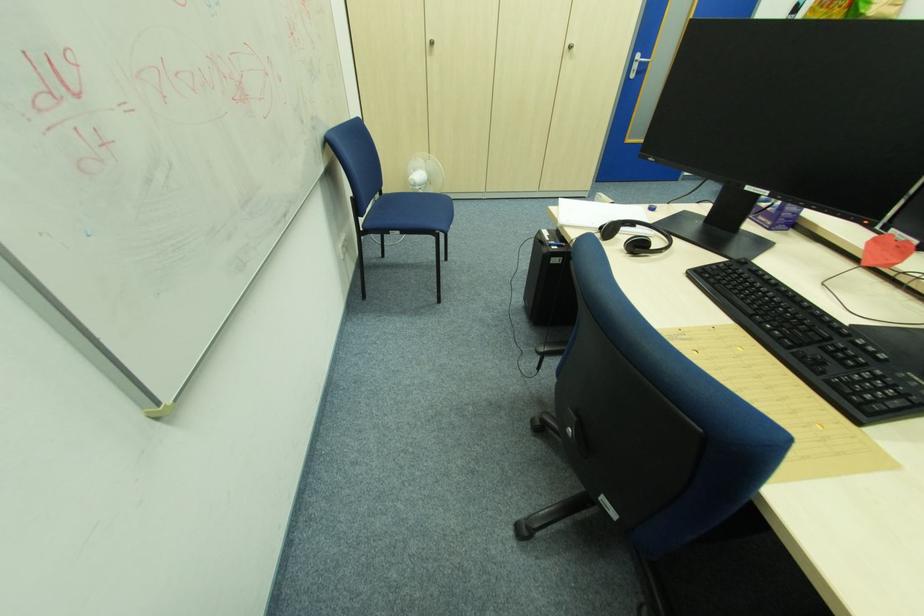
Image resolution: width=924 pixels, height=616 pixels. Describe the element at coordinates (409, 208) in the screenshot. I see `the blue chair sitting surface` at that location.